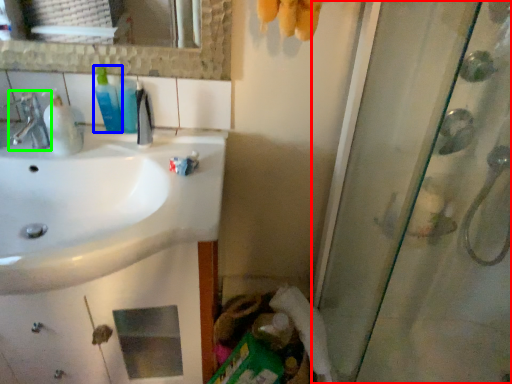
Question: Considering the real-world distances, which object is farthest from screen door (highlighted by a red box)? mouthwash (highlighted by a blue box) or tap (highlighted by a green box)?

Choices:
 (A) mouthwash
 (B) tap

Answer: (B)